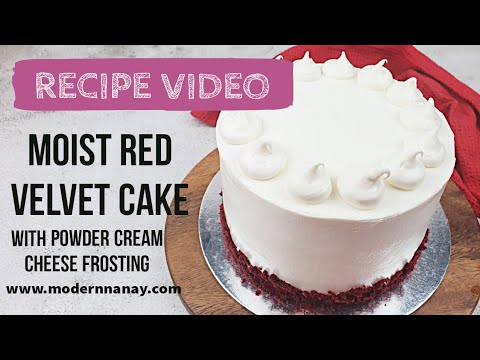
Find the location of a particular element. The width and height of the screenshot is (480, 360). wooden plate is located at coordinates (187, 260).